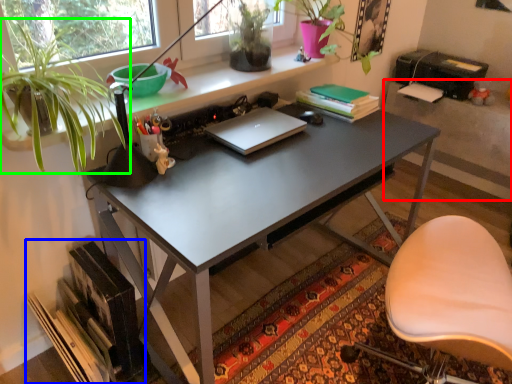
Question: Estimate the real-world distances between objects in this image. Which object is closer to table (highlighted by a red box), book (highlighted by a blue box) or houseplant (highlighted by a green box)?

Choices:
 (A) book
 (B) houseplant

Answer: (B)